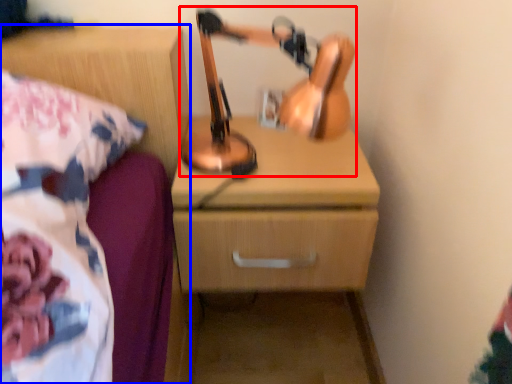
Question: Which point is further to the camera, table lamp (highlighted by a red box) or nightstand (highlighted by a blue box)?

Choices:
 (A) table lamp
 (B) nightstand

Answer: (A)